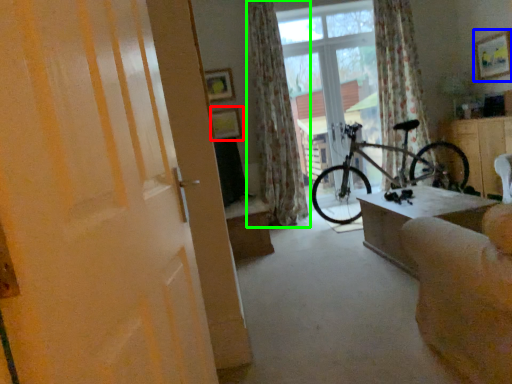
Question: Based on their relative distances, which object is farther from picture frame (highlighted by a red box)? Choose from picture frame (highlighted by a blue box) and curtain (highlighted by a green box).

Choices:
 (A) picture frame
 (B) curtain

Answer: (A)